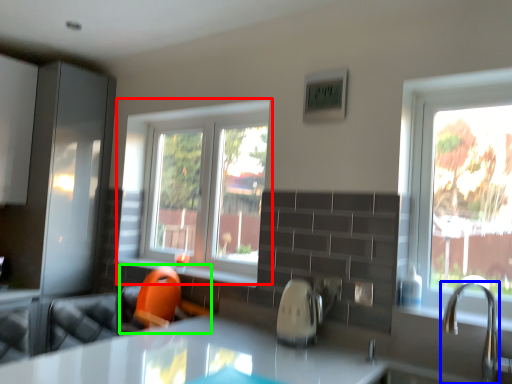
Question: Which object is positioned farthest from window (highlighted by a red box)? Select from tap (highlighted by a blue box) and swivel chair (highlighted by a green box).

Choices:
 (A) tap
 (B) swivel chair

Answer: (A)